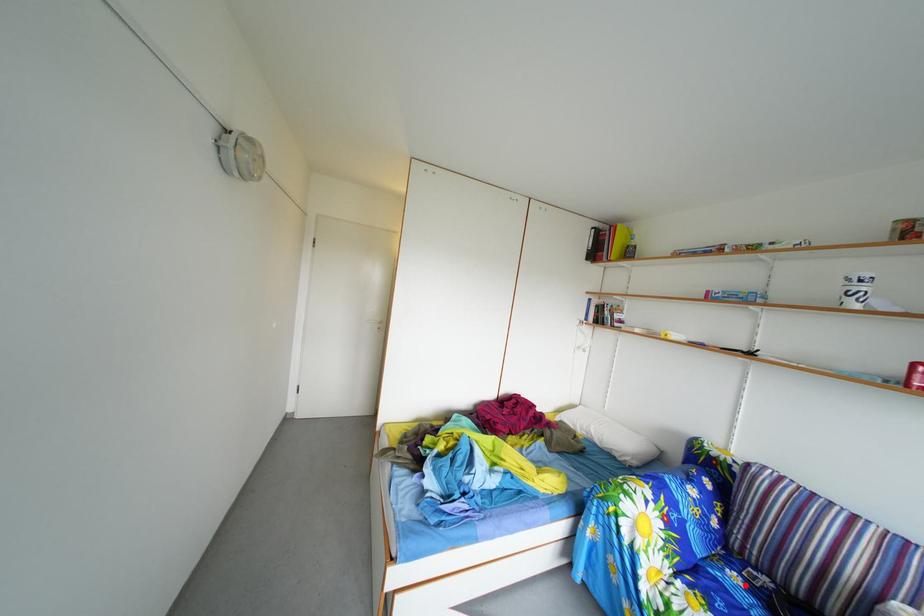
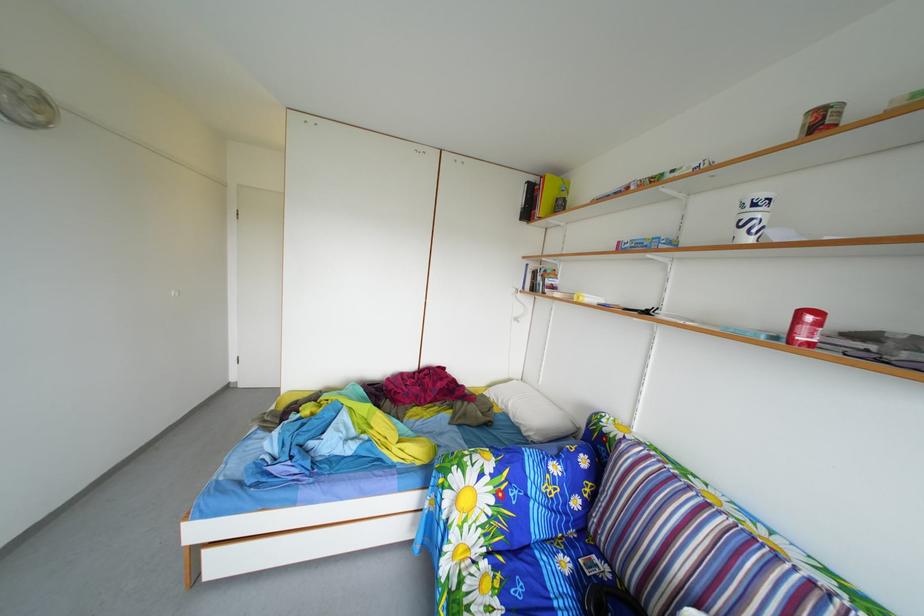
Question: I am providing you with two images of the same scene from different viewpoints. A red point is marked on the first image. At the location where the point appears in image 1, is it still visible in image 2?

Choices:
 (A) Yes
 (B) No

Answer: (A)